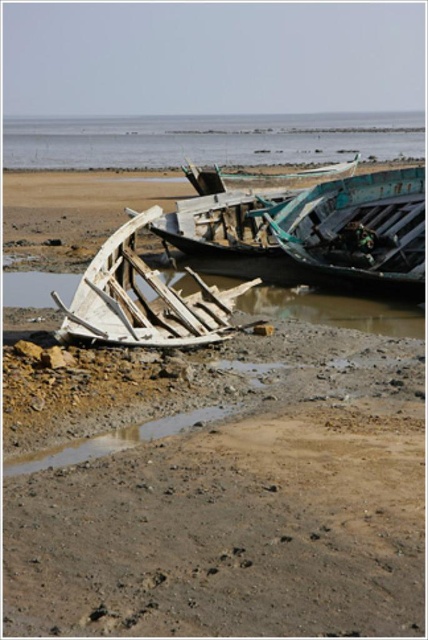
You are a photographer trying to capture the white wooden boat at center from the shore. The clear blue water at upper center is in the way. Can you adjust your angle to see the boat without the water blocking it?

The clear blue water at upper center is positioned over white wooden boat at center, so adjusting your angle might allow you to see the boat beneath the water. However, since the water is clear, you might still capture the boat through the water, depending on clarity and depth.

You are a marine biologist studying the boats in the image. You need to locate the teal wooden boat at upper center. What are its coordinates?

The teal wooden boat at upper center is located at coordinates point (357, 230).